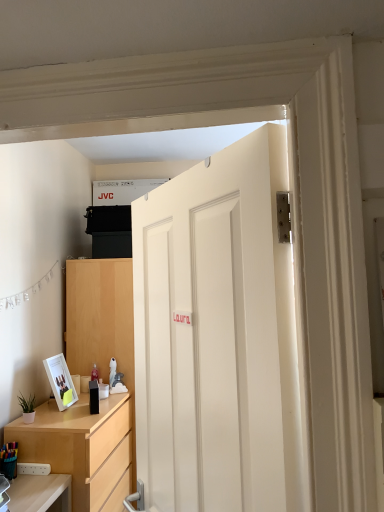
I want to click on free space behind green matte plant at lower left, so click(43, 413).